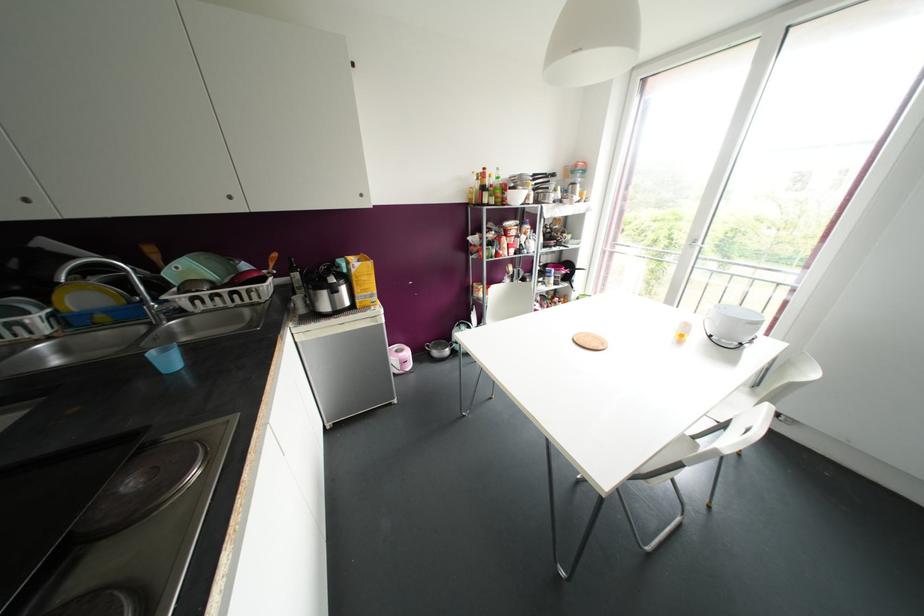
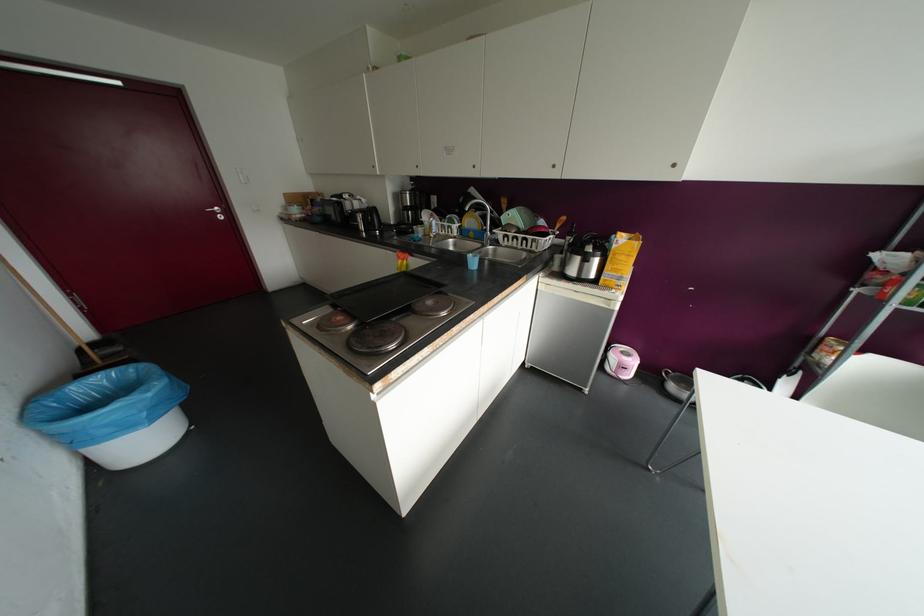
Locate, in the second image, the point that corresponds to pixel 27 200 in the first image.

(473, 166)